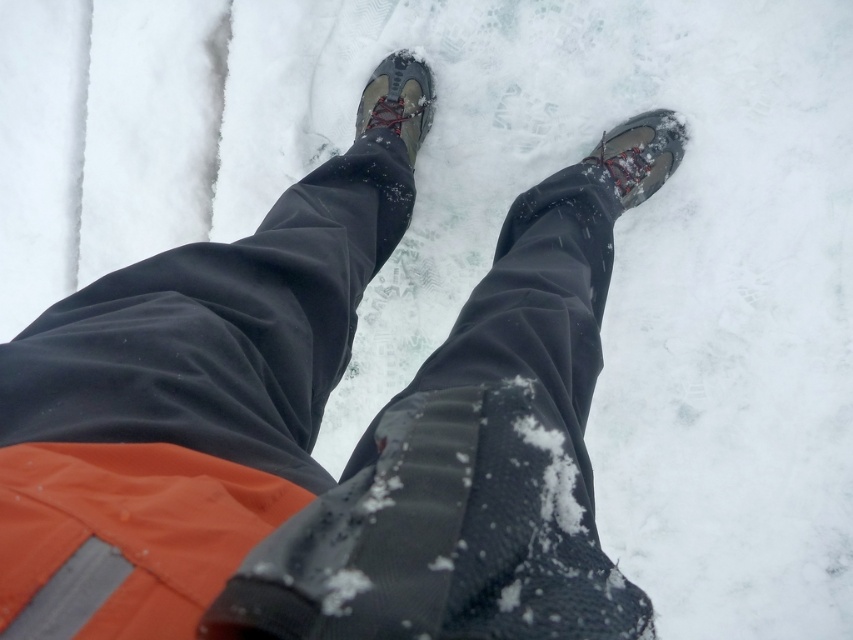
Question: Among these points, which one is farthest from the camera?

Choices:
 (A) (619, 129)
 (B) (402, 65)

Answer: (B)

Question: Is matte gray boot at lower right wider than matte gray boot at center?

Choices:
 (A) yes
 (B) no

Answer: (A)

Question: Which point appears farthest from the camera in this image?

Choices:
 (A) (677, 148)
 (B) (383, 93)

Answer: (B)

Question: Does matte gray boot at lower right appear on the right side of matte gray boot at center?

Choices:
 (A) yes
 (B) no

Answer: (A)

Question: Can you confirm if matte gray boot at lower right is positioned above matte gray boot at center?

Choices:
 (A) yes
 (B) no

Answer: (B)

Question: Which of the following is the closest to the observer?

Choices:
 (A) tap(415, 68)
 (B) tap(643, 115)

Answer: (B)